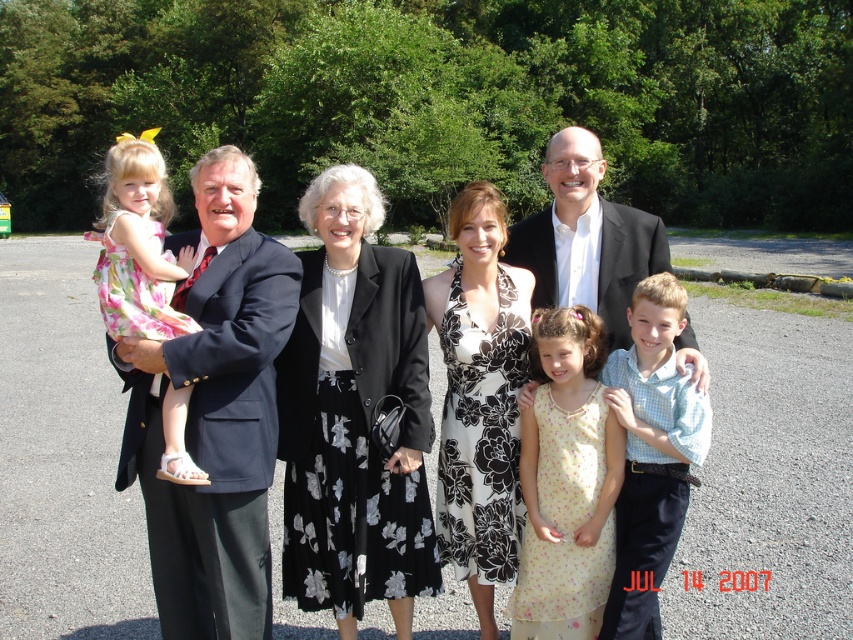
Based on the photo, can you confirm if black floral skirt at center is positioned above floral dress at center?

Actually, black floral skirt at center is below floral dress at center.

This screenshot has height=640, width=853. I want to click on black floral skirt at center, so click(x=354, y=416).

The image size is (853, 640). What do you see at coordinates (354, 416) in the screenshot?
I see `black floral skirt at center` at bounding box center [354, 416].

You are a GUI agent. You are given a task and a screenshot of the screen. Output one action in this format:
    pyautogui.click(x=<x>, y=<y>)
    Task: Click on the black floral skirt at center
    
    Given the screenshot: What is the action you would take?
    pyautogui.click(x=354, y=416)

Is black floral dress at center above pink floral dress at left?

Incorrect, black floral dress at center is not positioned above pink floral dress at left.

Who is lower down, black floral dress at center or pink floral dress at left?

black floral dress at center is lower down.

Is point (486, 454) positioned before point (115, 323)?

That is False.

Locate an element on the screen. This screenshot has width=853, height=640. black floral dress at center is located at coordinates (480, 435).

Does point (592, 173) come behind point (653, 442)?

Yes, point (592, 173) is behind point (653, 442).

Between point (141, 369) and point (630, 320), which one is positioned in front?

Point (141, 369)

At what (x,y) coordinates should I click in order to perform the action: click on floral dress at center. Please return your answer as a coordinate pair (x, y). Image resolution: width=853 pixels, height=640 pixels. Looking at the image, I should click on (596, 225).